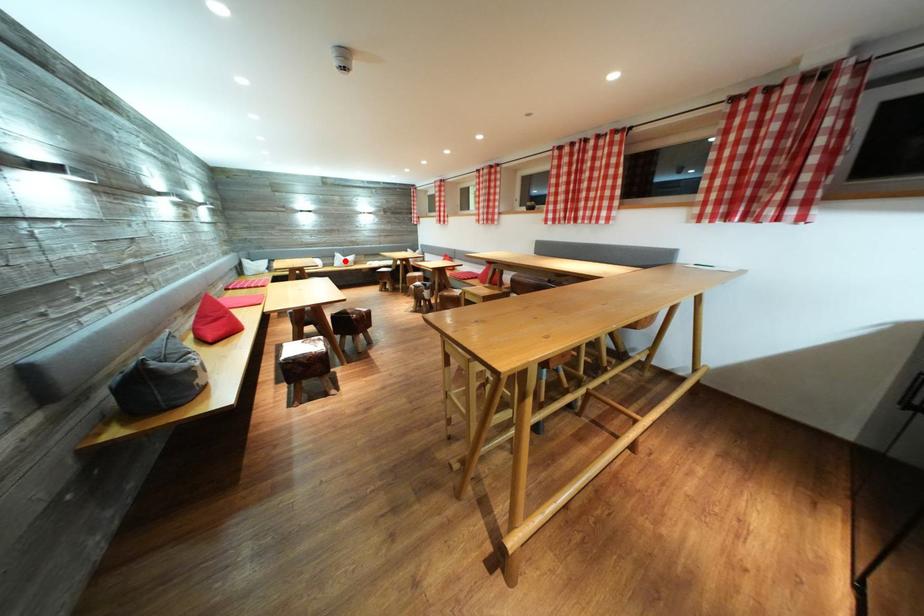
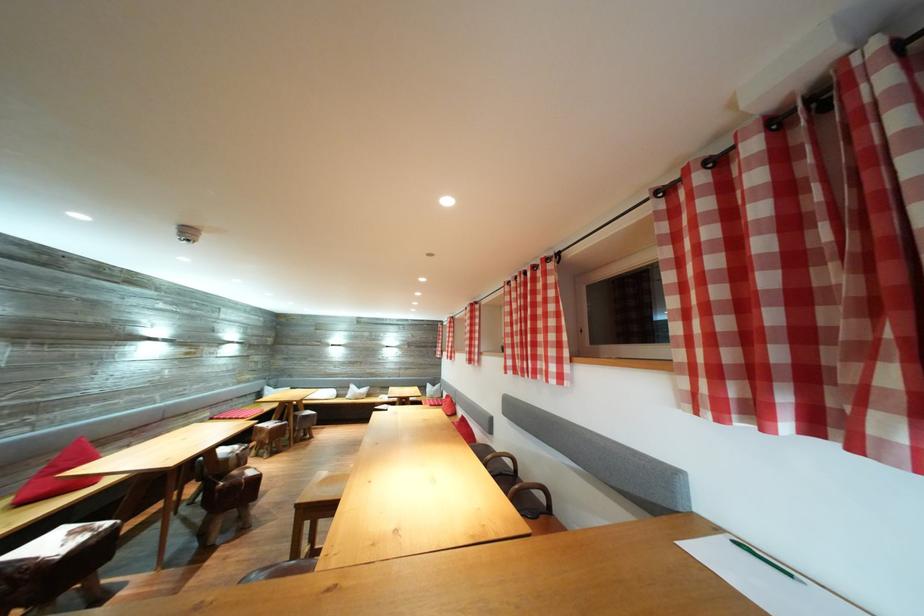
Question: I am providing you with two images of the same scene from different viewpoints. Given a red point in image1, look at the same physical point in image2. Is it:

Choices:
 (A) Closer to the viewpoint
 (B) Farther from the viewpoint

Answer: (B)